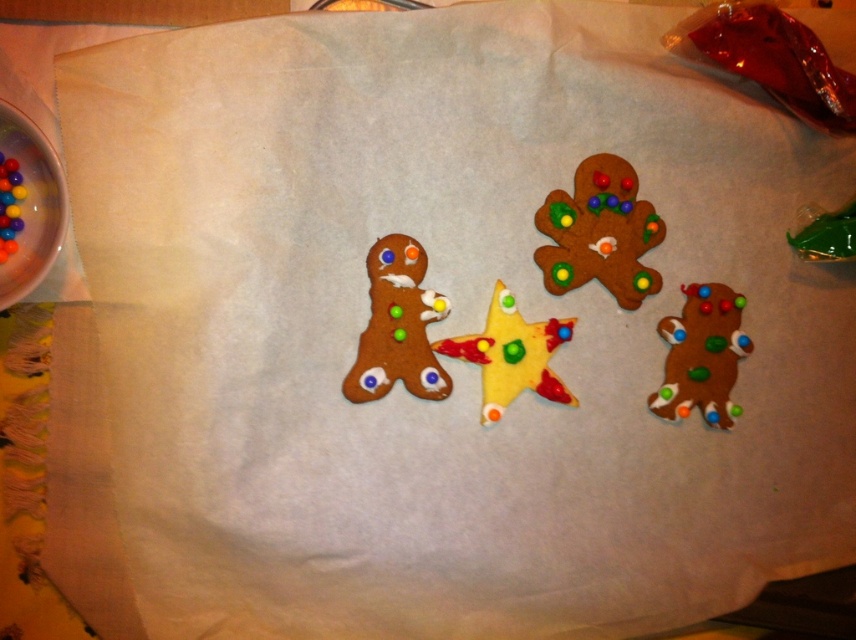
Does yellow glossy star at center appear under glossy multicolored beads at left?

Indeed, yellow glossy star at center is positioned under glossy multicolored beads at left.

Between yellow glossy star at center and glossy multicolored beads at left, which one has more height?

With more height is yellow glossy star at center.

This screenshot has width=856, height=640. Find the location of `yellow glossy star at center`. yellow glossy star at center is located at coordinates (510, 355).

This screenshot has height=640, width=856. I want to click on yellow glossy star at center, so click(510, 355).

Is point (553, 227) positioned after point (714, 426)?

That is True.

Which is above, matte brown gingerbread man at upper right or matte brown gingerbread man at lower right?

matte brown gingerbread man at upper right is higher up.

Between point (587, 198) and point (697, 372), which one is positioned in front?

Point (697, 372) is in front.

Where is `matte brown gingerbread man at upper right`? This screenshot has height=640, width=856. matte brown gingerbread man at upper right is located at coordinates (599, 232).

Can you confirm if matte brown gingerbread man at upper right is bigger than glossy multicolored beads at left?

Correct, matte brown gingerbread man at upper right is larger in size than glossy multicolored beads at left.

Does matte brown gingerbread man at upper right have a smaller size compared to glossy multicolored beads at left?

No.

Which is behind, point (559, 224) or point (18, 172)?

Positioned behind is point (559, 224).

The height and width of the screenshot is (640, 856). Find the location of `matte brown gingerbread man at upper right`. matte brown gingerbread man at upper right is located at coordinates (599, 232).